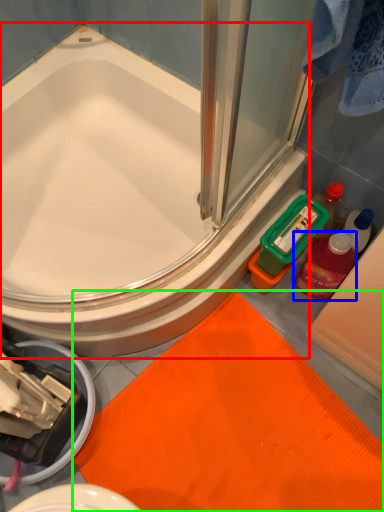
Question: Based on their relative distances, which object is farther from bathtub (highlighted by a red box)? Choose from mouthwash (highlighted by a blue box) and bath mat (highlighted by a green box).

Choices:
 (A) mouthwash
 (B) bath mat

Answer: (A)